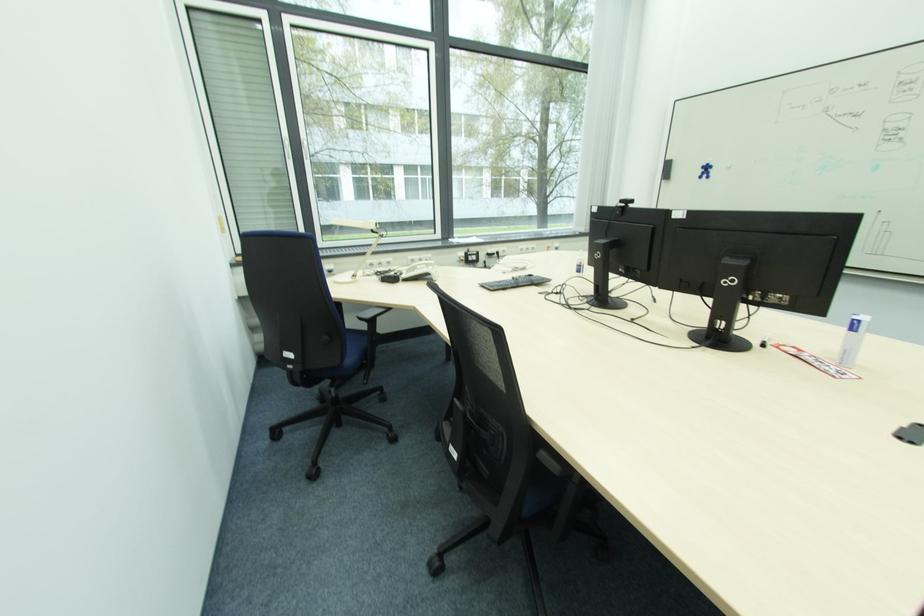
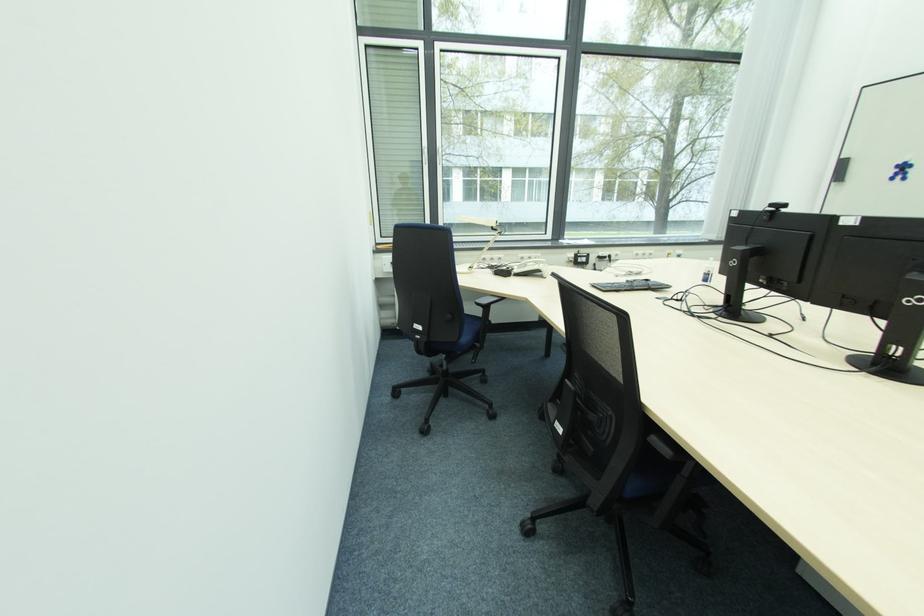
In the second image, find the point that corresponds to point (346, 363) in the first image.

(463, 341)